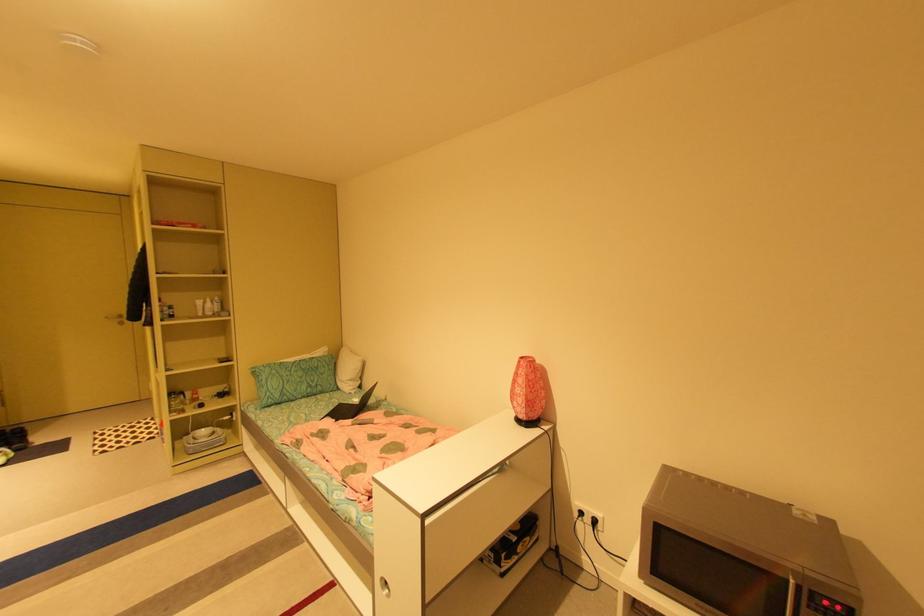
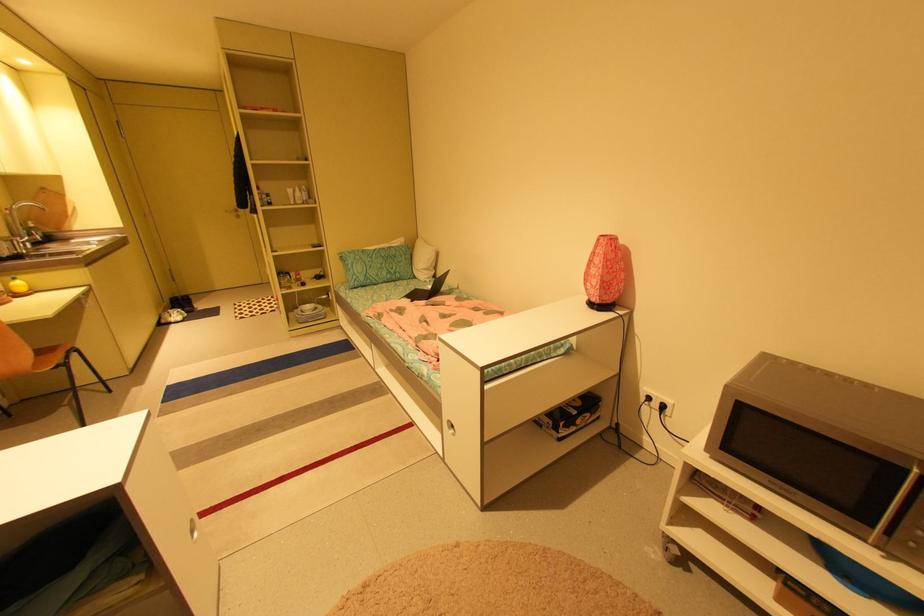
Which direction would the cameraman need to move to produce the second image?

The cameraman walked toward right, forward.